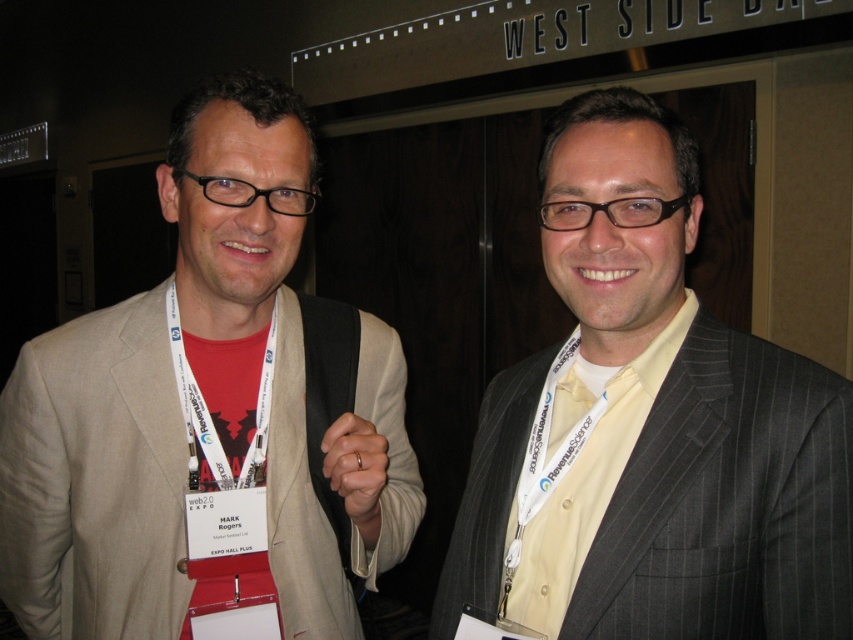
Question: Is gray pinstripe suit at center above yellow fabric at center?

Choices:
 (A) no
 (B) yes

Answer: (A)

Question: Which point is closer to the camera taking this photo?

Choices:
 (A) (747, 534)
 (B) (227, 301)

Answer: (A)

Question: Which point is closer to the camera?

Choices:
 (A) (160, 355)
 (B) (213, 337)
 (C) (560, 595)
 (D) (665, 321)

Answer: (C)

Question: Is matte beige suit at center further to the viewer compared to gray pinstripe suit at center?

Choices:
 (A) yes
 (B) no

Answer: (A)

Question: Which object is closer to the camera taking this photo?

Choices:
 (A) gray pinstripe suit at center
 (B) red matte neck at center

Answer: (A)

Question: Can you confirm if gray pinstripe suit at center is bigger than red matte neck at center?

Choices:
 (A) yes
 (B) no

Answer: (A)